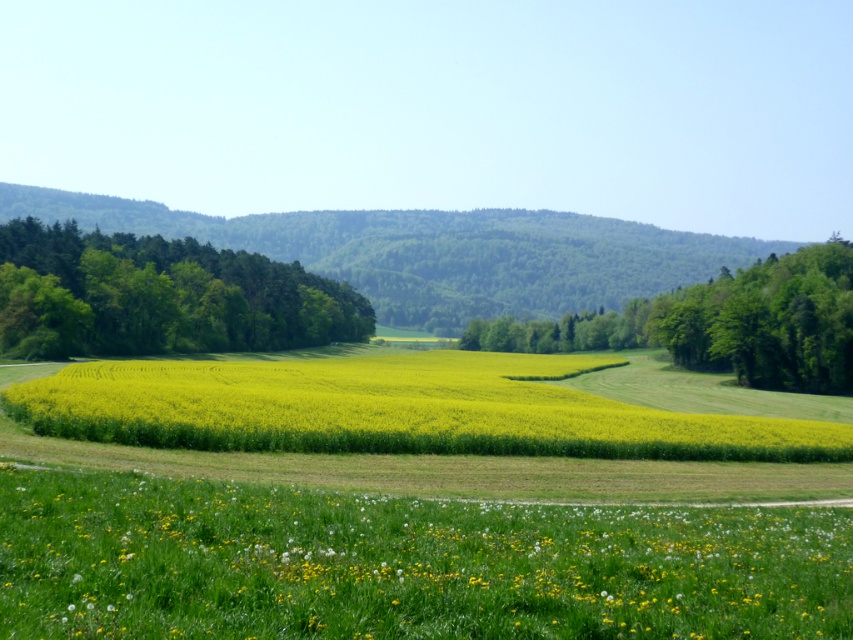
Question: Among these points, which one is farthest from the camera?

Choices:
 (A) (607, 532)
 (B) (311, 420)
 (C) (798, 352)
 (D) (561, 298)

Answer: (D)

Question: Can you confirm if yellow matte field at center is positioned to the left of green leafy hillside at center?

Choices:
 (A) yes
 (B) no

Answer: (A)

Question: Which of the following is the farthest from the observer?

Choices:
 (A) (579, 536)
 (B) (225, 388)
 (C) (140, 339)

Answer: (C)

Question: Observing the image, what is the correct spatial positioning of yellow matte field at center in reference to green leafy trees at center?

Choices:
 (A) above
 (B) below

Answer: (B)

Question: Can you confirm if green leafy hillside at center is thinner than green leafy trees at left?

Choices:
 (A) no
 (B) yes

Answer: (A)

Question: Considering the real-world distances, which object is closest to the yellow matte field at center?

Choices:
 (A) green leafy trees at center
 (B) green leafy hillside at center
 (C) yellow soft grass at lower center
 (D) green leafy trees at left

Answer: (C)